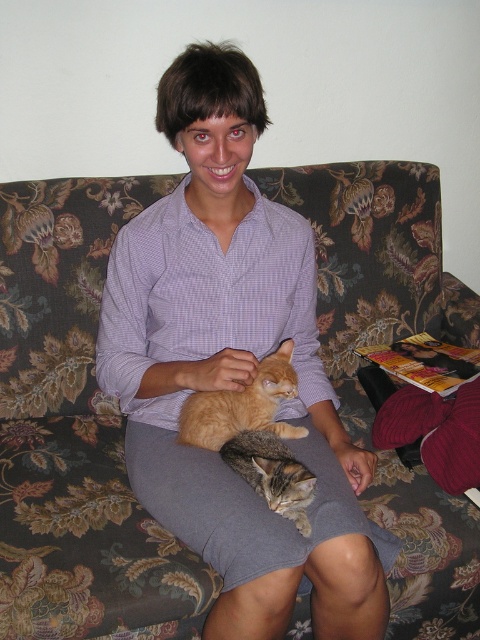
You are a photographer taking a portrait of the orange fur cat at center and the tabby fur cat at center. Which cat should you focus on if you want to capture the one that is taller?

The orange fur cat at center is much taller than the tabby fur cat at center, so you should focus on the orange fur cat at center.

You are a photographer setting up for a family portrait. You need to position the orange fur cat at center so it faces the camera while ensuring the floral fabric couch at center doesn

The orange fur cat at center is behind the floral fabric couch at center, so you should move the cat forward so it is in front of the couch to face the camera properly.

You are a photographer trying to capture a closeup of the orange fur cat at center and the tabby fur cat at center. Since the camera can only focus on one cat at a time, which cat should you focus on to ensure the one closer to the camera is in focus?

The orange fur cat at center is above the tabby fur cat at center, so focusing on the orange fur cat at center would ensure the closer cat is in focus.